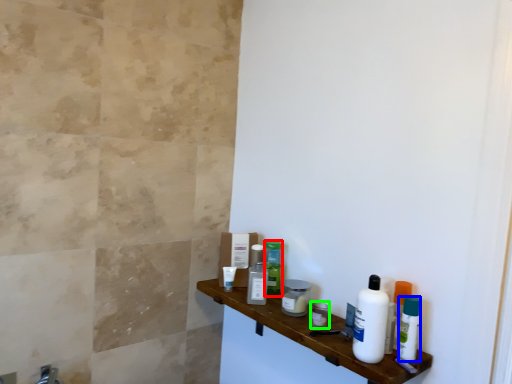
Question: Estimate the real-world distances between objects in this image. Which object is closer to toiletry (highlighted by a red box), mouthwash (highlighted by a blue box) or toiletry (highlighted by a green box)?

Choices:
 (A) mouthwash
 (B) toiletry

Answer: (B)